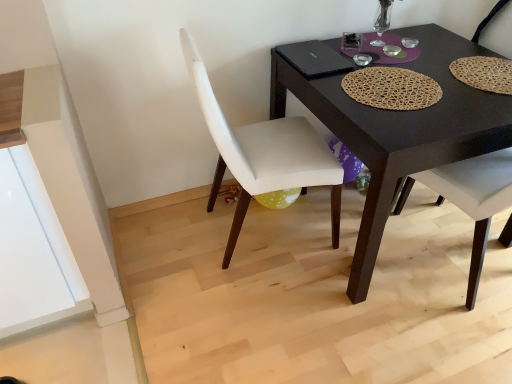
You are a GUI agent. You are given a task and a screenshot of the screen. Output one action in this format:
    pyautogui.click(x=<x>, y=<y>)
    Task: Click on the free space in front of black matte desk at center
    This screenshot has height=384, width=512.
    Given the screenshot: What is the action you would take?
    pyautogui.click(x=370, y=331)